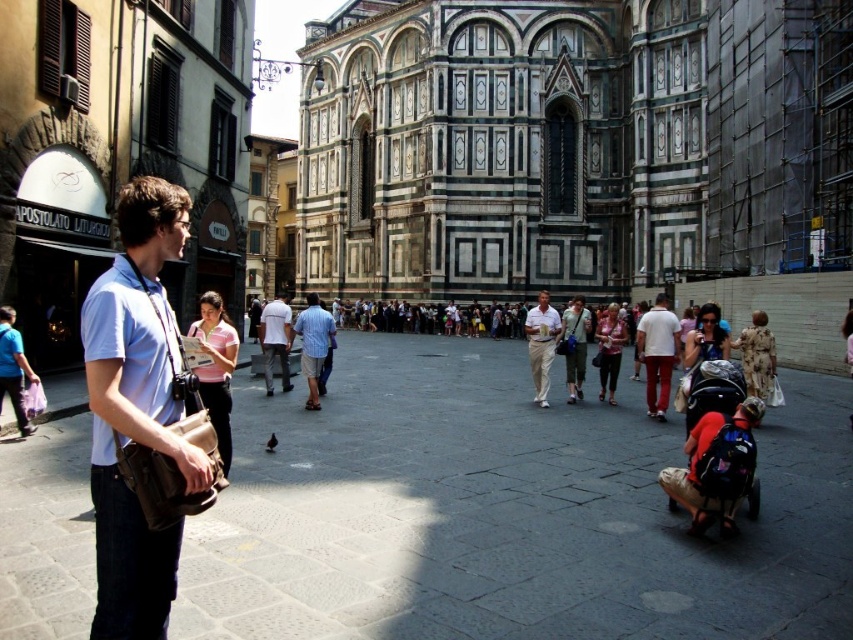
You are standing in the square in front of the cathedral and want to move from the point at coordinates point [325,339] to the point at coordinates point [531,324]. Which direction should you walk to get closer to your destination?

You should walk backward because point [325,339] is in front of point [531,324], so moving backward will bring you closer to the destination.